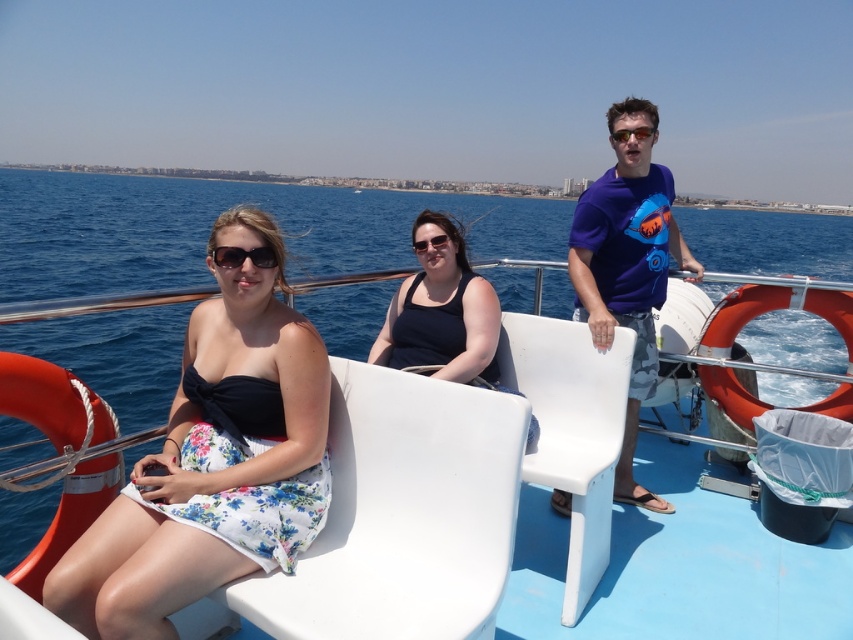
Does matte black sunglasses at center appear on the right side of transparent plastic goggles at center?

Incorrect, matte black sunglasses at center is not on the right side of transparent plastic goggles at center.

Which is below, matte black sunglasses at center or transparent plastic goggles at center?

Positioned lower is matte black sunglasses at center.

In order to click on matte black sunglasses at center in this screenshot , I will do `click(242, 257)`.

Does white plastic chair at center appear under clear plastic goggles at center?

Indeed, white plastic chair at center is positioned under clear plastic goggles at center.

Which is below, white plastic chair at center or clear plastic goggles at center?

white plastic chair at center is below.

You are a GUI agent. You are given a task and a screenshot of the screen. Output one action in this format:
    pyautogui.click(x=<x>, y=<y>)
    Task: Click on the white plastic chair at center
    The width and height of the screenshot is (853, 640).
    Given the screenshot: What is the action you would take?
    pyautogui.click(x=517, y=512)

Can you confirm if matte black dress at center is bigger than transparent plastic goggles at center?

Yes.

Can you confirm if matte black dress at center is positioned below transparent plastic goggles at center?

Yes, matte black dress at center is below transparent plastic goggles at center.

Find the location of a particular element. The width and height of the screenshot is (853, 640). matte black dress at center is located at coordinates (213, 460).